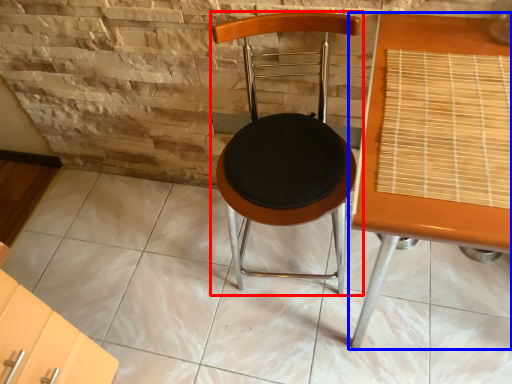
Question: Which point is closer to the camera, chair (highlighted by a red box) or table (highlighted by a blue box)?

Choices:
 (A) chair
 (B) table

Answer: (B)